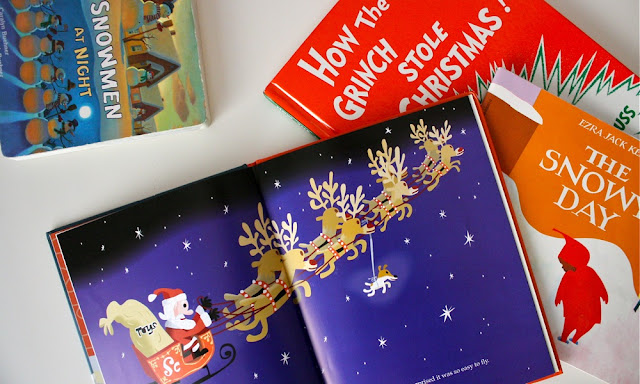
Locate an element on the screen. Image resolution: width=640 pixels, height=384 pixels. book is located at coordinates (576, 232).